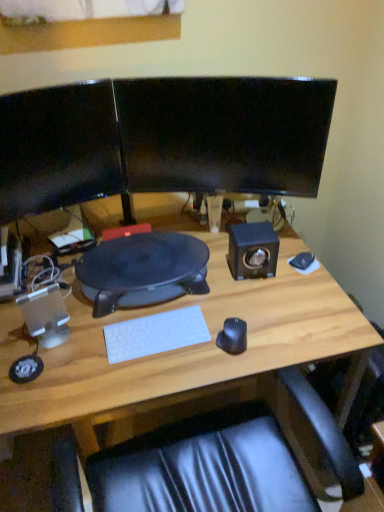
This screenshot has height=512, width=384. Find the location of `vacant space behind matte black speaker at right, which is the 1th speaker in top-to-bottom order`. vacant space behind matte black speaker at right, which is the 1th speaker in top-to-bottom order is located at coordinates (225, 234).